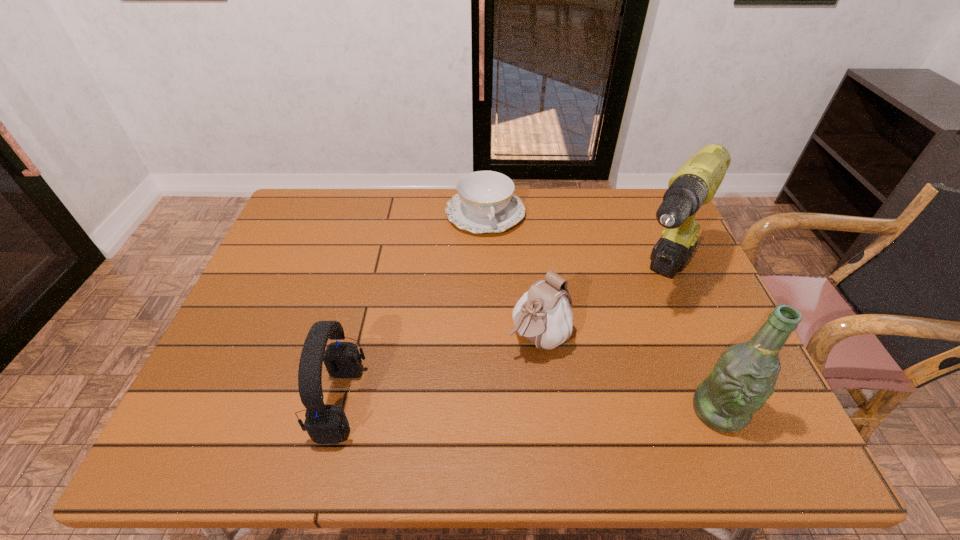
Locate an element on the screen. The height and width of the screenshot is (540, 960). vacant space located on the front-facing side of the pouch is located at coordinates (479, 397).

Image resolution: width=960 pixels, height=540 pixels. What are the coordinates of `vacant space located 0.080m on the front-facing side of the pouch` in the screenshot? It's located at (496, 379).

Locate an element on the screen. The image size is (960, 540). blank space located 0.310m on the handle side of the chinaware is located at coordinates (517, 315).

Image resolution: width=960 pixels, height=540 pixels. In order to click on free space located 0.240m on the handle side of the chinaware in this screenshot , I will do `click(511, 295)`.

Identify the location of vacant space located 0.230m on the handle side of the chinaware. (510, 292).

Locate an element on the screen. vacant space situated 0.060m on the handle side of the drill is located at coordinates (635, 327).

Where is `free space located 0.240m on the handle side of the drill`? free space located 0.240m on the handle side of the drill is located at coordinates (602, 377).

Where is `vacant space located 0.060m on the handle side of the drill`? The image size is (960, 540). vacant space located 0.060m on the handle side of the drill is located at coordinates (635, 327).

Where is `object that is at the far edge`? The image size is (960, 540). object that is at the far edge is located at coordinates [485, 202].

Identify the location of headset positioned at the near edge. The width and height of the screenshot is (960, 540). (325, 424).